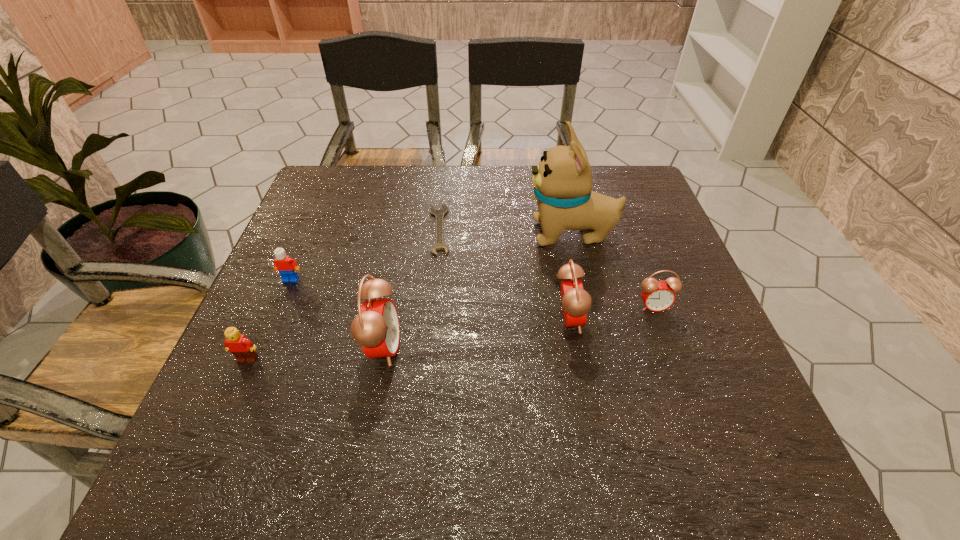
You are a GUI agent. You are given a task and a screenshot of the screen. Output one action in this format:
    pyautogui.click(x=<x>, y=<y>)
    Task: Click on the vacant position located on the clock face of the second shortest alarm clock
    The width and height of the screenshot is (960, 540).
    Given the screenshot: What is the action you would take?
    pyautogui.click(x=658, y=319)

Find the location of a particular element. free space located 0.080m on the clock face of the shortest alarm clock is located at coordinates (667, 343).

You are a GUI agent. You are given a task and a screenshot of the screen. Output one action in this format:
    pyautogui.click(x=<x>, y=<y>)
    Task: Click on the free space located 0.200m on the front of the shortest object
    
    Given the screenshot: What is the action you would take?
    pyautogui.click(x=430, y=321)

At what (x,y) coordinates should I click in order to perform the action: click on vacant space located on the face of the puppy. Please return your answer as a coordinate pair (x, y). Image resolution: width=960 pixels, height=540 pixels. Looking at the image, I should click on (479, 234).

Locate an element on the screen. The image size is (960, 540). vacant area situated on the face of the puppy is located at coordinates (413, 234).

Where is `free space located on the face of the puppy`? The width and height of the screenshot is (960, 540). free space located on the face of the puppy is located at coordinates (440, 234).

The width and height of the screenshot is (960, 540). Find the location of `vacant area located on the face of the nearer Lego`. vacant area located on the face of the nearer Lego is located at coordinates (228, 402).

Find the location of a particular element. free space located on the face of the farther Lego is located at coordinates (234, 413).

In order to click on object that is positioned at the far edge in this screenshot , I will do `click(439, 214)`.

This screenshot has height=540, width=960. Identify the location of object located in the near edge section of the desktop. (x=376, y=328).